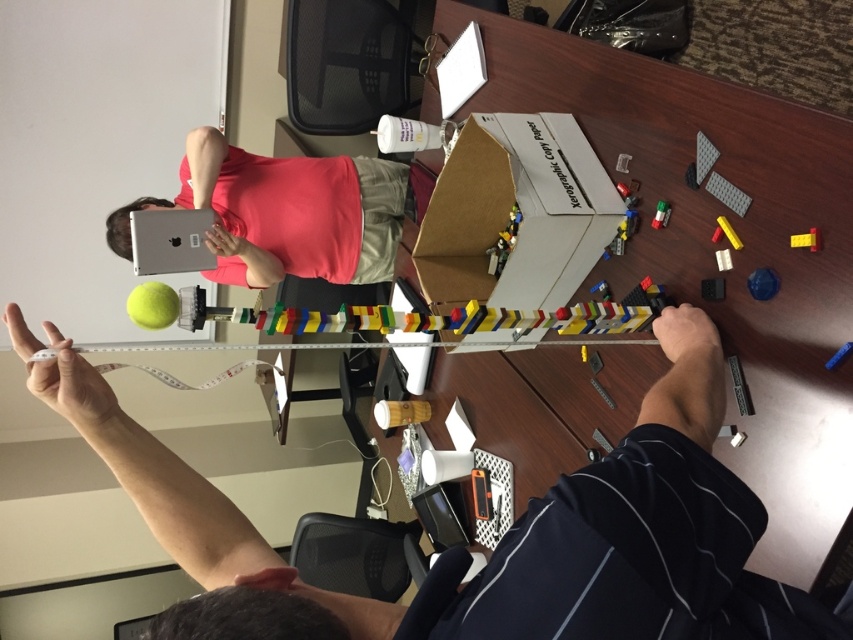
Question: Which of the following is the farthest from the observer?

Choices:
 (A) (283, 173)
 (B) (726, 236)
 (C) (817, 237)

Answer: (A)

Question: Which of the following is the closest to the observer?

Choices:
 (A) matte black tape measure at upper left
 (B) green matte lego at center
 (C) translucent plastic toy at center

Answer: (A)

Question: Is matte black tape measure at upper left bigger than blue matte block at center?

Choices:
 (A) no
 (B) yes

Answer: (B)

Question: Based on their relative distances, which object is nearer to the wooden table at center?

Choices:
 (A) matte black tape measure at upper left
 (B) translucent plastic toy at center

Answer: (B)

Question: Is yellow matte brick at upper right behind yellow matte marker at upper right?

Choices:
 (A) yes
 (B) no

Answer: (B)

Question: Is wooden table at center to the right of matte black tape measure at upper left from the viewer's perspective?

Choices:
 (A) no
 (B) yes

Answer: (B)